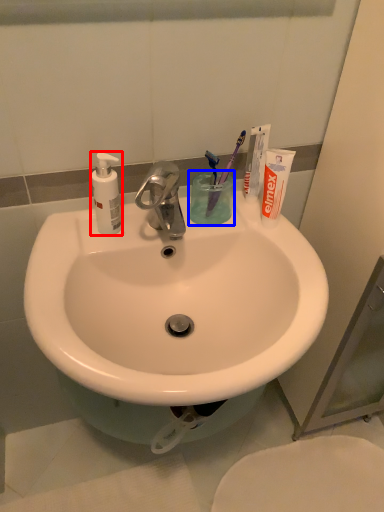
Question: Which point is further to the camera, soap dispenser (highlighted by a red box) or liquid (highlighted by a blue box)?

Choices:
 (A) soap dispenser
 (B) liquid

Answer: (B)